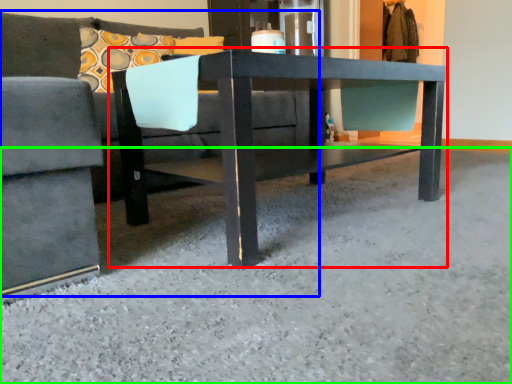
Question: Considering the real-world distances, which object is closest to table (highlighted by a red box)? studio couch (highlighted by a blue box) or concrete (highlighted by a green box).

Choices:
 (A) studio couch
 (B) concrete

Answer: (B)